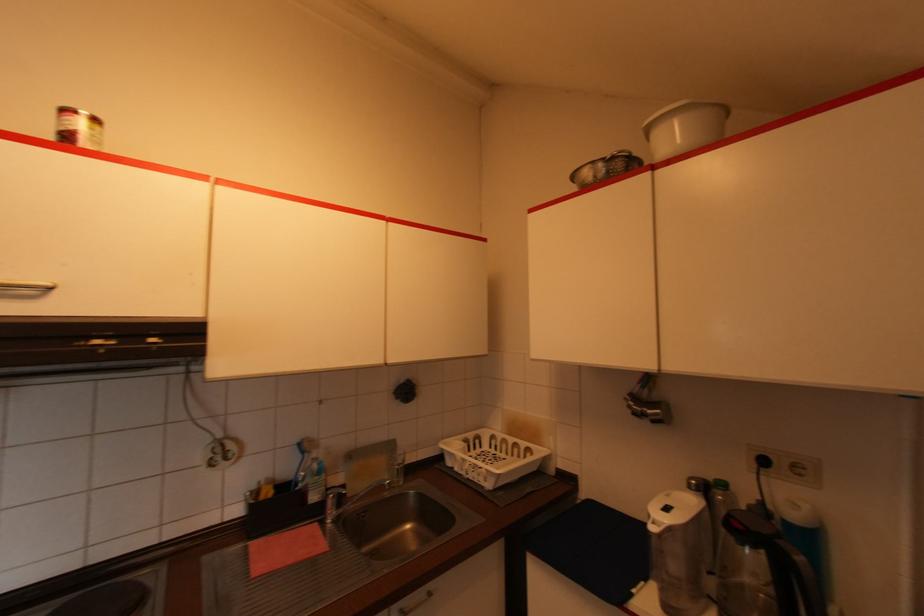
Find the location of a particular element. Image resolution: width=924 pixels, height=616 pixels. silver cabinet handle is located at coordinates (26, 286).